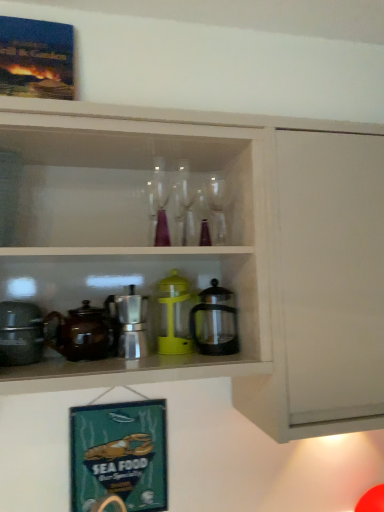
The image size is (384, 512). Identify the location of matte white cabinet at upper center. (213, 250).

In order to face yellow plastic container at center, the first appliance from the right, should I rotate leftwards or rightwards?

Rotate your view left by about 2.920°.

Measure the distance between yellow plastic container at center, the first appliance from the right, and camera.

yellow plastic container at center, the first appliance from the right, is 3.61 feet from camera.

What do you see at coordinates (215, 322) in the screenshot? The image size is (384, 512). I see `transparent glass coffee pot at center, the first coffeepot from the right` at bounding box center [215, 322].

Find the location of a particular element. The image size is (384, 512). wooden picture frame at upper left, the first picture frame from the front is located at coordinates (36, 58).

Image resolution: width=384 pixels, height=512 pixels. What do you see at coordinates (82, 333) in the screenshot?
I see `metallic silver coffee pot at center, which is the 1th coffeepot in left-to-right order` at bounding box center [82, 333].

You are a GUI agent. You are given a task and a screenshot of the screen. Output one action in this format:
    pyautogui.click(x=<x>, y=<y>)
    Task: Click on the metallic silver coffee pot at center, which is the 1th coffeepot in left-to-right order
    The image size is (384, 512).
    Given the screenshot: What is the action you would take?
    pyautogui.click(x=82, y=333)

The width and height of the screenshot is (384, 512). What are the coordinates of `matte white cabinet at upper center` in the screenshot? It's located at (213, 250).

Between clear glass wine glass at center, which ranks as the 2th wine glass in left-to-right order, and clear glass wine glass at center, which is counted as the 2th wine glass, starting from the right, which one has larger size?

Bigger between the two is clear glass wine glass at center, which is counted as the 2th wine glass, starting from the right.

Is clear glass wine glass at center, the first wine glass in the right-to-left sequence, spatially inside clear glass wine glass at center, which is counted as the 2th wine glass, starting from the right, or outside of it?

clear glass wine glass at center, the first wine glass in the right-to-left sequence, lies outside clear glass wine glass at center, which is counted as the 2th wine glass, starting from the right.

How much distance is there between clear glass wine glass at center, which ranks as the 2th wine glass in left-to-right order, and clear glass wine glass at center, positioned as the first wine glass in left-to-right order?

They are 6.50 centimeters apart.

Is clear glass wine glass at center, the first wine glass in the right-to-left sequence, facing away from clear glass wine glass at center, positioned as the first wine glass in left-to-right order?

That's not correct — clear glass wine glass at center, the first wine glass in the right-to-left sequence, is not looking away from clear glass wine glass at center, positioned as the first wine glass in left-to-right order.

Considering the relative positions of clear glass wine glass at center, which is counted as the 2th wine glass, starting from the right, and green fabric signboard at lower left, positioned as the second picture frame in top-to-bottom order, in the image provided, is clear glass wine glass at center, which is counted as the 2th wine glass, starting from the right, to the left or to the right of green fabric signboard at lower left, positioned as the second picture frame in top-to-bottom order,?

Clearly, clear glass wine glass at center, which is counted as the 2th wine glass, starting from the right, is on the right of green fabric signboard at lower left, positioned as the second picture frame in top-to-bottom order, in the image.

Which of these two, clear glass wine glass at center, which is counted as the 2th wine glass, starting from the right, or green fabric signboard at lower left, placed as the first picture frame when sorted from back to front, is bigger?

green fabric signboard at lower left, placed as the first picture frame when sorted from back to front, is bigger.

Is clear glass wine glass at center, which is counted as the 2th wine glass, starting from the right, looking in the opposite direction of green fabric signboard at lower left, placed as the 1th picture frame when sorted from bottom to top?

clear glass wine glass at center, which is counted as the 2th wine glass, starting from the right, does not have its back to green fabric signboard at lower left, placed as the 1th picture frame when sorted from bottom to top.

From a real-world perspective, which wine glass is the 1st one above the green fabric signboard at lower left, placed as the 1th picture frame when sorted from bottom to top? Please provide its 2D coordinates.

[(158, 204)]

Is matte black pot at left, positioned as the first appliance in left-to-right order, located within metallic silver coffee pot at center, arranged as the 2th coffeepot when viewed from the right?

Actually, matte black pot at left, positioned as the first appliance in left-to-right order, is outside metallic silver coffee pot at center, arranged as the 2th coffeepot when viewed from the right.

Is point (68, 347) more distant than point (35, 357)?

Yes, point (68, 347) is behind point (35, 357).

Where is `appliance in front of the metallic silver coffee pot at center, which is the 1th coffeepot in left-to-right order`? The width and height of the screenshot is (384, 512). appliance in front of the metallic silver coffee pot at center, which is the 1th coffeepot in left-to-right order is located at coordinates (20, 333).

Is metallic silver coffee pot at center, arranged as the 2th coffeepot when viewed from the right, taller than matte black pot at left, the second appliance when ordered from right to left?

Correct, metallic silver coffee pot at center, arranged as the 2th coffeepot when viewed from the right, is much taller as matte black pot at left, the second appliance when ordered from right to left.

Considering the points (187, 336) and (150, 241), which point is behind, point (187, 336) or point (150, 241)?

Positioned behind is point (150, 241).

Locate an element on the screen. Image resolution: width=384 pixels, height=512 pixels. wine glass in front of the yellow plastic container at center, the first appliance from the right is located at coordinates (158, 204).

From a real-world perspective, relative to clear glass wine glass at center, positioned as the first wine glass in left-to-right order, is yellow plastic container at center, the first appliance from the right, vertically above or below?

yellow plastic container at center, the first appliance from the right, is situated lower than clear glass wine glass at center, positioned as the first wine glass in left-to-right order, in the real world.

Considering the sizes of objects clear glass wine glass at center, which is counted as the 2th wine glass, starting from the right, and metallic silver coffee pot at center, which is the 1th coffeepot in left-to-right order, in the image provided, who is taller, clear glass wine glass at center, which is counted as the 2th wine glass, starting from the right, or metallic silver coffee pot at center, which is the 1th coffeepot in left-to-right order,?

With more height is clear glass wine glass at center, which is counted as the 2th wine glass, starting from the right.

Is clear glass wine glass at center, which is counted as the 2th wine glass, starting from the right, looking in the opposite direction of metallic silver coffee pot at center, which is the 1th coffeepot in left-to-right order?

clear glass wine glass at center, which is counted as the 2th wine glass, starting from the right, does not have its back to metallic silver coffee pot at center, which is the 1th coffeepot in left-to-right order.

Considering the relative sizes of clear glass wine glass at center, which is counted as the 2th wine glass, starting from the right, and metallic silver coffee pot at center, which is the 1th coffeepot in left-to-right order, in the image provided, is clear glass wine glass at center, which is counted as the 2th wine glass, starting from the right, bigger than metallic silver coffee pot at center, which is the 1th coffeepot in left-to-right order,?

No, clear glass wine glass at center, which is counted as the 2th wine glass, starting from the right, is not bigger than metallic silver coffee pot at center, which is the 1th coffeepot in left-to-right order.

From the image's perspective, is matte black pot at left, the second appliance when ordered from right to left, positioned above or below transparent glass coffee pot at center, the first coffeepot from the right?

matte black pot at left, the second appliance when ordered from right to left, is below transparent glass coffee pot at center, the first coffeepot from the right.

Can you confirm if matte black pot at left, positioned as the first appliance in left-to-right order, is shorter than transparent glass coffee pot at center, the first coffeepot from the right?

Yes, matte black pot at left, positioned as the first appliance in left-to-right order, is shorter than transparent glass coffee pot at center, the first coffeepot from the right.

Which is closer to the camera, (26, 339) or (208, 303)?

Point (26, 339) is closer to the camera than point (208, 303).

Is matte black pot at left, the second appliance when ordered from right to left, in front of transparent glass coffee pot at center, which is counted as the 2th coffeepot, starting from the left?

Yes, matte black pot at left, the second appliance when ordered from right to left, is in front of transparent glass coffee pot at center, which is counted as the 2th coffeepot, starting from the left.

Locate an element on the screen. The height and width of the screenshot is (512, 384). picture frame above the yellow plastic container at center, the first appliance from the right (from the image's perspective) is located at coordinates (36, 58).

Which is correct: wooden picture frame at upper left, the first picture frame from the front, is inside yellow plastic container at center, which is the 2th appliance from left to right, or outside of it?

wooden picture frame at upper left, the first picture frame from the front, cannot be found inside yellow plastic container at center, which is the 2th appliance from left to right.

Considering the relative sizes of wooden picture frame at upper left, the first picture frame from the front, and yellow plastic container at center, which is the 2th appliance from left to right, in the image provided, is wooden picture frame at upper left, the first picture frame from the front, shorter than yellow plastic container at center, which is the 2th appliance from left to right,?

In fact, wooden picture frame at upper left, the first picture frame from the front, may be taller than yellow plastic container at center, which is the 2th appliance from left to right.

In the scene shown: From the image's perspective, who appears lower, wooden picture frame at upper left, which is the second picture frame in back-to-front order, or yellow plastic container at center, which is the 2th appliance from left to right?

yellow plastic container at center, which is the 2th appliance from left to right, from the image's perspective.

I want to click on wine glass on the right of the clear glass wine glass at center, positioned as the first wine glass in left-to-right order, so click(187, 205).

The height and width of the screenshot is (512, 384). Find the location of `picture frame below the clear glass wine glass at center, positioned as the first wine glass in left-to-right order (from the image's perspective)`. picture frame below the clear glass wine glass at center, positioned as the first wine glass in left-to-right order (from the image's perspective) is located at coordinates (119, 455).

From the image, which object appears to be farther from clear glass wine glass at center, positioned as the first wine glass in left-to-right order, wooden picture frame at upper left, which is counted as the 2th picture frame, starting from the bottom, or matte black pot at left, positioned as the first appliance in left-to-right order?

matte black pot at left, positioned as the first appliance in left-to-right order.

When comparing their distances from metallic silver coffee pot at center, arranged as the 2th coffeepot when viewed from the right, does wooden picture frame at upper left, which is the first picture frame in top-to-bottom order, or matte black pot at left, the second appliance when ordered from right to left, seem further?

wooden picture frame at upper left, which is the first picture frame in top-to-bottom order.

Estimate the real-world distances between objects in this image. Which object is closer to green fabric signboard at lower left, placed as the 1th picture frame when sorted from bottom to top, clear glass wine glass at center, which ranks as the 2th wine glass in left-to-right order, or clear glass wine glass at center, which is counted as the 2th wine glass, starting from the right?

clear glass wine glass at center, which is counted as the 2th wine glass, starting from the right, is positioned closer to the anchor green fabric signboard at lower left, placed as the 1th picture frame when sorted from bottom to top.

Looking at the image, which one is located further to yellow plastic container at center, which is the 2th appliance from left to right, matte black pot at left, positioned as the first appliance in left-to-right order, or matte white cabinet at upper center?

Among the two, matte black pot at left, positioned as the first appliance in left-to-right order, is located further to yellow plastic container at center, which is the 2th appliance from left to right.

Considering their positions, is matte white cabinet at upper center positioned further to transparent glass coffee pot at center, which is counted as the 2th coffeepot, starting from the left, than matte black pot at left, positioned as the first appliance in left-to-right order?

The object further to transparent glass coffee pot at center, which is counted as the 2th coffeepot, starting from the left, is matte black pot at left, positioned as the first appliance in left-to-right order.

Which object lies further to the anchor point clear glass wine glass at center, which ranks as the 2th wine glass in left-to-right order, transparent glass coffee pot at center, the first coffeepot from the right, or clear glass wine glass at center, which is counted as the 2th wine glass, starting from the right?

Based on the image, transparent glass coffee pot at center, the first coffeepot from the right, appears to be further to clear glass wine glass at center, which ranks as the 2th wine glass in left-to-right order.

When comparing their distances from clear glass wine glass at center, which ranks as the 2th wine glass in left-to-right order, does yellow plastic container at center, the first appliance from the right, or green fabric signboard at lower left, placed as the 1th picture frame when sorted from bottom to top, seem further?

green fabric signboard at lower left, placed as the 1th picture frame when sorted from bottom to top, is positioned further to the anchor clear glass wine glass at center, which ranks as the 2th wine glass in left-to-right order.

When comparing their distances from clear glass wine glass at center, which is counted as the 2th wine glass, starting from the right, does green fabric signboard at lower left, positioned as the second picture frame in top-to-bottom order, or transparent glass coffee pot at center, which is counted as the 2th coffeepot, starting from the left, seem further?

Among the two, green fabric signboard at lower left, positioned as the second picture frame in top-to-bottom order, is located further to clear glass wine glass at center, which is counted as the 2th wine glass, starting from the right.

Identify the location of appliance between clear glass wine glass at center, which is counted as the 2th wine glass, starting from the right, and metallic silver coffee pot at center, arranged as the 2th coffeepot when viewed from the right, in the up-down direction. (173, 315).

Identify the location of cabinetry between clear glass wine glass at center, the first wine glass in the right-to-left sequence, and green fabric signboard at lower left, the second picture frame positioned from the front, vertically. The height and width of the screenshot is (512, 384). (213, 250).

Where is `wine glass between clear glass wine glass at center, which ranks as the 2th wine glass in left-to-right order, and metallic silver coffee pot at center, which is the 1th coffeepot in left-to-right order, from top to bottom`? wine glass between clear glass wine glass at center, which ranks as the 2th wine glass in left-to-right order, and metallic silver coffee pot at center, which is the 1th coffeepot in left-to-right order, from top to bottom is located at coordinates (158, 204).

You are a GUI agent. You are given a task and a screenshot of the screen. Output one action in this format:
    pyautogui.click(x=<x>, y=<y>)
    Task: Click on the wine glass located between matte black pot at left, positioned as the first appliance in left-to-right order, and clear glass wine glass at center, which ranks as the 2th wine glass in left-to-right order, in the left-right direction
    Image resolution: width=384 pixels, height=512 pixels.
    Given the screenshot: What is the action you would take?
    pyautogui.click(x=158, y=204)